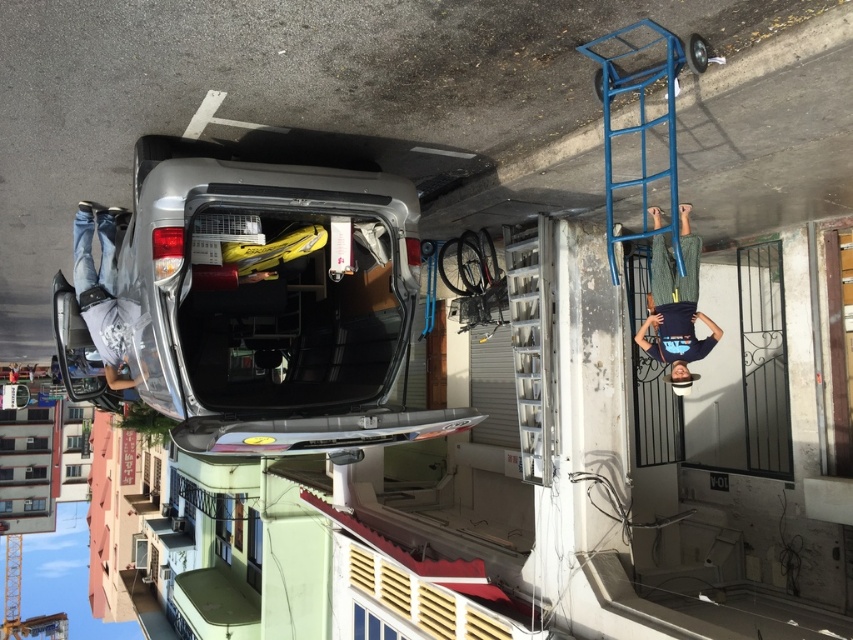
What are the coordinates of the satin silver car at center?

The satin silver car at center is located at coordinates point (x=274, y=300).

You are a delivery person who needs to place a large package that requires 3 meters of space. You see the satin silver car at center and the blue metal ladder on the right. Is there enough space between them to place your package?

The distance between the satin silver car at center and the blue metal ladder on the right is 3.69 meters, which is more than enough to accommodate the 3 meter package.

You are a delivery person who needs to place a package between the dark green knitted sweater at upper right and the jeans at left. The package requires a space of 4 meters. Can you fit it there?

The dark green knitted sweater at upper right and jeans at left are 4.25 meters apart from each other. Since the required space is 4 meters, the package can be placed there as the available space is sufficient.